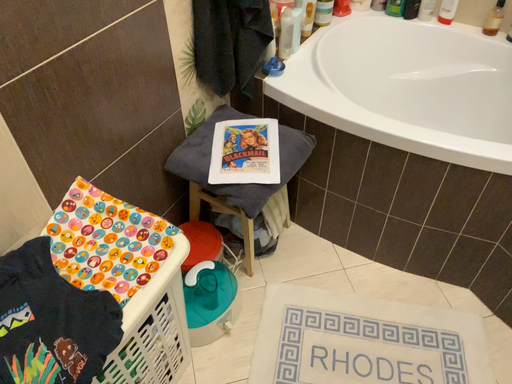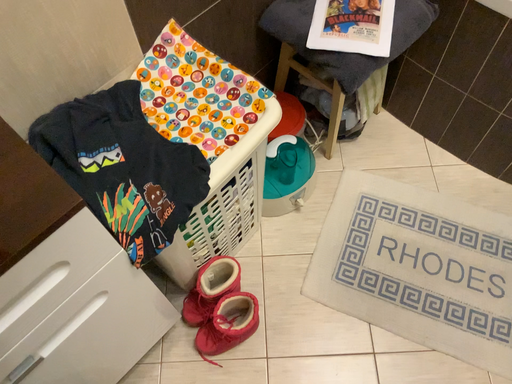
Question: Which way did the camera rotate in the video?

Choices:
 (A) rotated left
 (B) rotated right

Answer: (A)